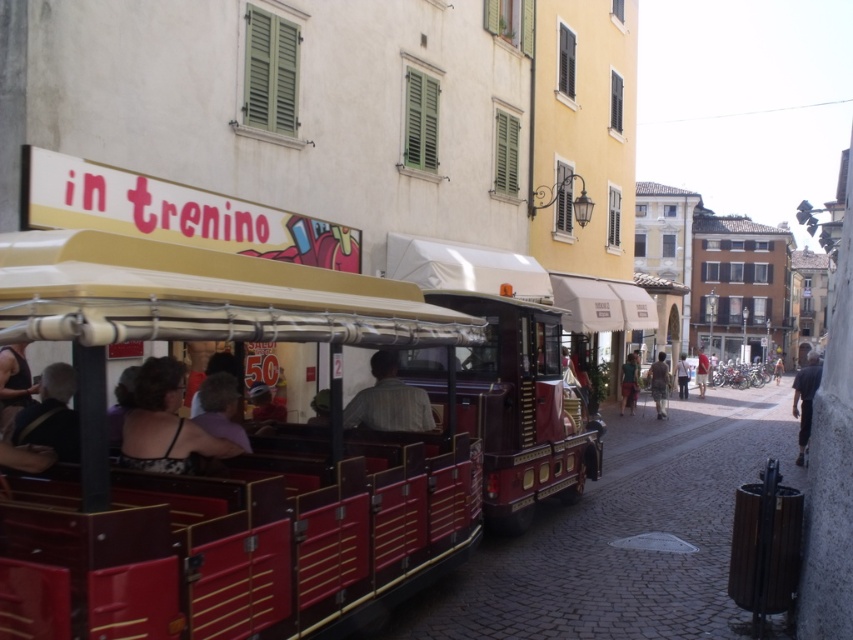
Question: Which of the following is the farthest from the observer?

Choices:
 (A) metallic red tram at center
 (B) green fabric dress at center
 (C) light blue denim jacket at center

Answer: (C)

Question: Which of the following is the farthest from the observer?

Choices:
 (A) (743, 474)
 (B) (479, 250)
 (C) (161, 368)
 (D) (622, 385)

Answer: (D)

Question: In this image, where is metallic red tram at center located relative to green fabric dress at center?

Choices:
 (A) above
 (B) below

Answer: (A)

Question: Is light blue denim jacket at center to the right of red cotton shirt at center from the viewer's perspective?

Choices:
 (A) no
 (B) yes

Answer: (A)

Question: Can you confirm if metallic red trolley at center is positioned above light blue denim jacket at center?

Choices:
 (A) no
 (B) yes

Answer: (A)

Question: Which point is farther to the camera?

Choices:
 (A) brown textured shirt at center
 (B) red cotton shirt at center
 (C) light blue denim jacket at center
 (D) metallic red tram at center

Answer: (B)